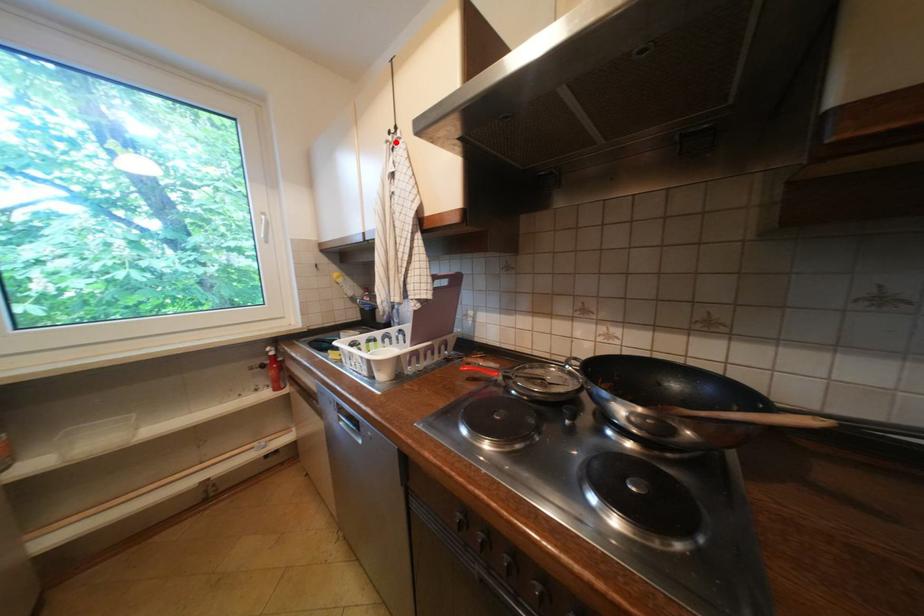
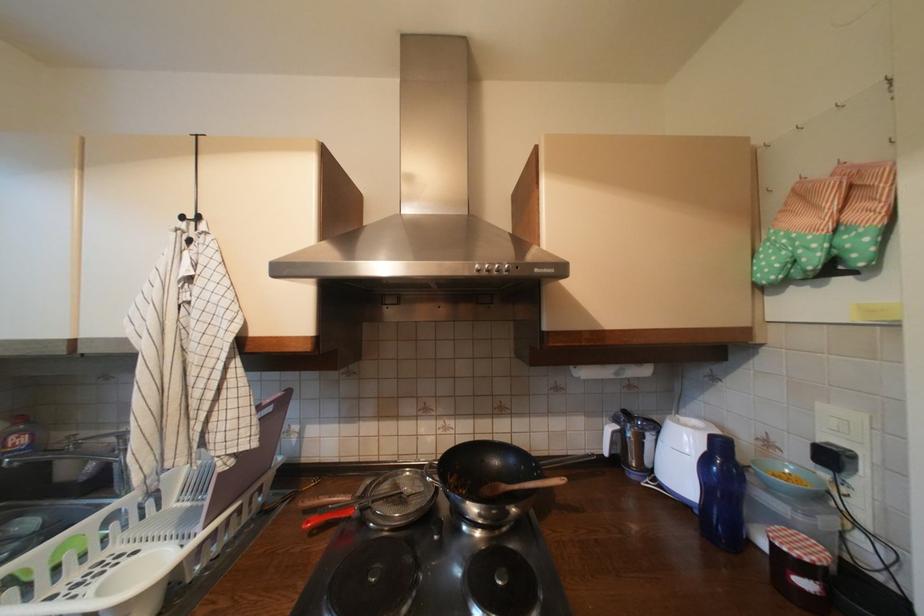
Where in the second image is the point corresponding to the highlighted location from the first image?

(187, 230)